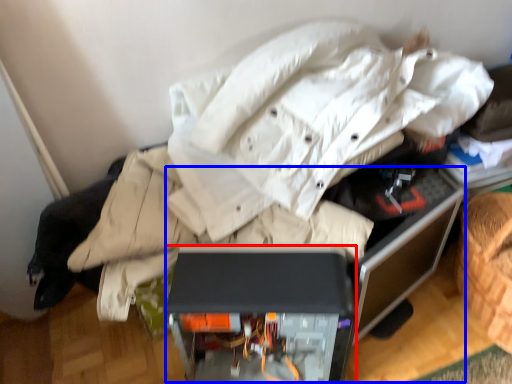
Question: Among these objects, which one is farthest to the camera, furniture (highlighted by a red box) or computer desk (highlighted by a blue box)?

Choices:
 (A) furniture
 (B) computer desk

Answer: (A)